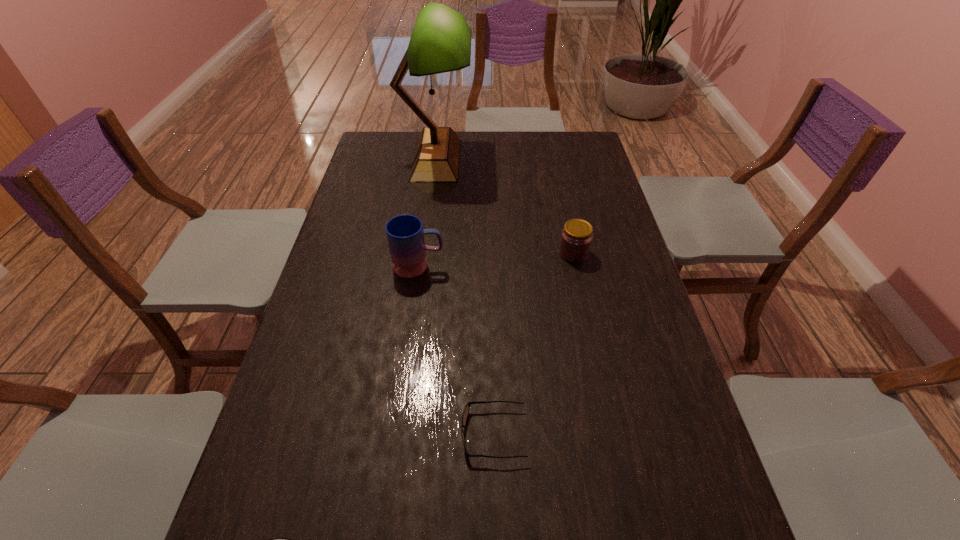
Find the location of a particular element. The width and height of the screenshot is (960, 540). the farthest object is located at coordinates [x=440, y=42].

You are a GUI agent. You are given a task and a screenshot of the screen. Output one action in this format:
    pyautogui.click(x=<x>, y=<y>)
    Task: Click on the tallest object
    This screenshot has width=960, height=540.
    Given the screenshot: What is the action you would take?
    pyautogui.click(x=440, y=42)

Find the location of a particular element. the fourth shortest object is located at coordinates (405, 234).

Locate an element on the screen. This screenshot has width=960, height=540. jam is located at coordinates (576, 238).

Where is `the third shortest object`? The width and height of the screenshot is (960, 540). the third shortest object is located at coordinates (576, 238).

You are a GUI agent. You are given a task and a screenshot of the screen. Output one action in this format:
    pyautogui.click(x=<x>, y=<y>)
    Task: Click on the sunglasses
    The image size is (960, 540).
    Given the screenshot: What is the action you would take?
    pyautogui.click(x=465, y=414)

The height and width of the screenshot is (540, 960). Find the location of `the second shortest object`. the second shortest object is located at coordinates (465, 414).

This screenshot has height=540, width=960. Identify the location of vacant space located 0.090m on the metallic stand of the table lamp. (496, 159).

Image resolution: width=960 pixels, height=540 pixels. I want to click on vacant point located on the side of the mug with the handle, so click(x=479, y=266).

This screenshot has width=960, height=540. What are the coordinates of `free region located on the front of the rightmost object` in the screenshot? It's located at (599, 372).